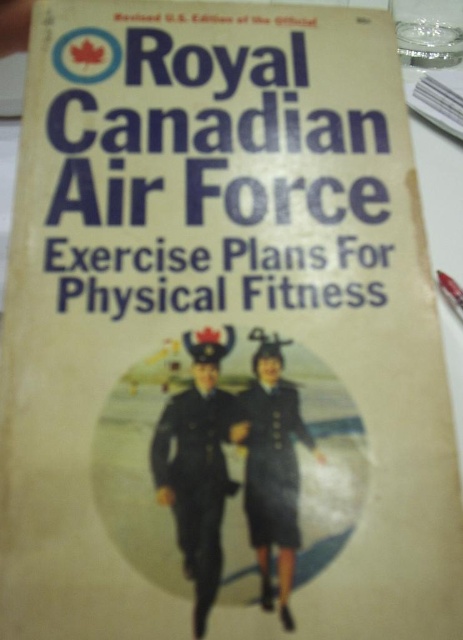
Question: Where is dark blue uniform at center located in relation to dark blue woolen dress at center in the image?

Choices:
 (A) above
 (B) below

Answer: (B)

Question: Which point is closer to the camera?

Choices:
 (A) dark blue woolen dress at center
 (B) dark blue uniform at center

Answer: (B)

Question: Can you confirm if dark blue uniform at center is smaller than dark blue woolen dress at center?

Choices:
 (A) no
 (B) yes

Answer: (A)

Question: Can you confirm if dark blue uniform at center is thinner than dark blue woolen dress at center?

Choices:
 (A) yes
 (B) no

Answer: (B)